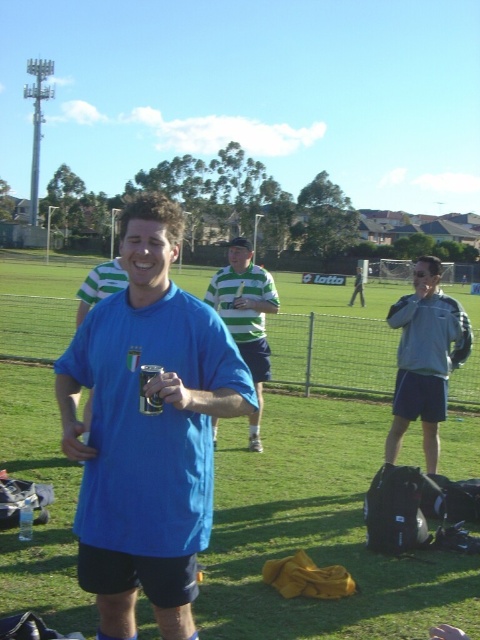
You are a photographer trying to capture a clear shot of the green grass at center and the green striped polo shirt at center. Based on their heights, which object would appear larger in the photo?

The green grass at center is taller than the green striped polo shirt at center, so the green grass at center would appear larger in the photo.

You are standing in the outdoor scene and want to place a small picnic basket between the green grass at center and the gray fleece jacket at right. Which object should the basket be closer to if you want it to be nearer to the viewer?

The picnic basket should be placed closer to the green grass at center because it is nearer to the viewer compared to the gray fleece jacket at right.